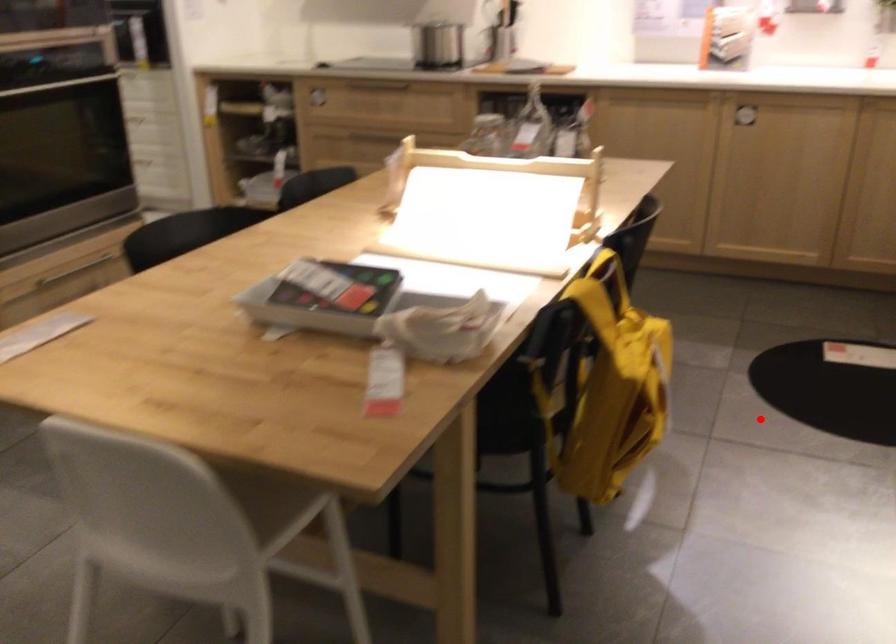
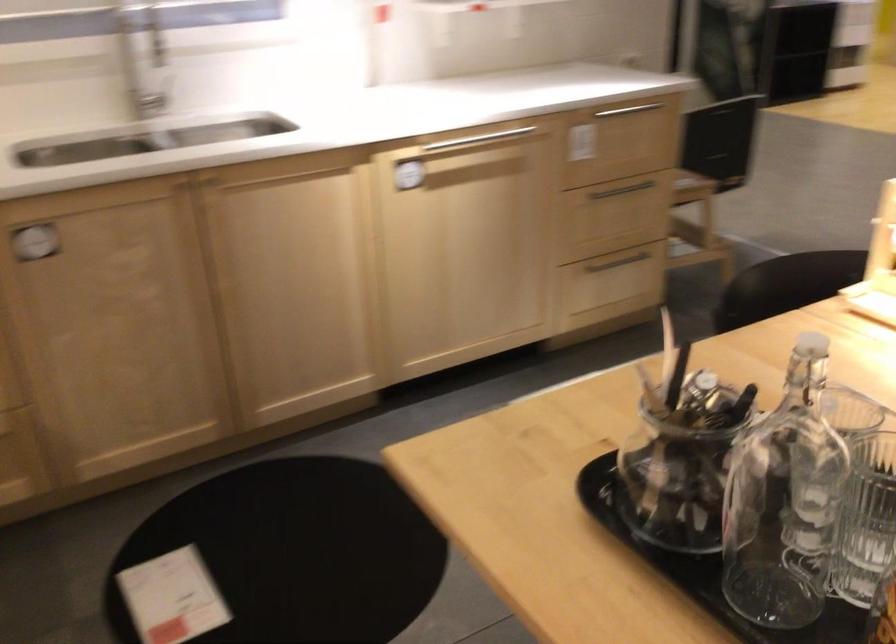
Question: I am providing you with two images of the same scene from different viewpoints. A red point is marked on the first image. Is the red point's position out of view in image 2?

Choices:
 (A) Yes
 (B) No

Answer: (A)